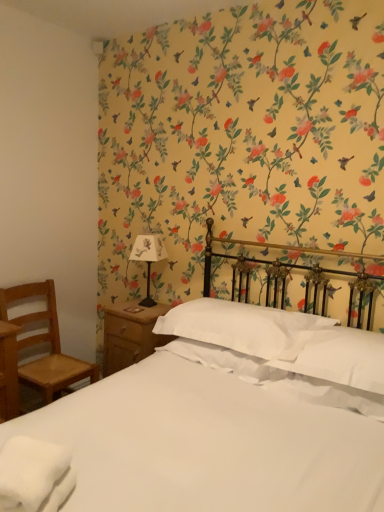
Question: From a real-world perspective, is wooden chair at left below white soft towel at lower left?

Choices:
 (A) yes
 (B) no

Answer: (A)

Question: Is wooden chair at left aimed at white soft towel at lower left?

Choices:
 (A) yes
 (B) no

Answer: (B)

Question: From a real-world perspective, is wooden chair at left located higher than white soft towel at lower left?

Choices:
 (A) no
 (B) yes

Answer: (A)

Question: From the image's perspective, does wooden chair at left appear higher than white soft towel at lower left?

Choices:
 (A) no
 (B) yes

Answer: (A)

Question: Does wooden chair at left have a greater width compared to white soft towel at lower left?

Choices:
 (A) yes
 (B) no

Answer: (A)

Question: Is white soft towel at lower left located within wooden chair at left?

Choices:
 (A) yes
 (B) no

Answer: (B)

Question: Is white satin bed at center wider than white soft pillow at center, the 2th pillow positioned from the right?

Choices:
 (A) yes
 (B) no

Answer: (A)

Question: Is white satin bed at center turned away from white soft pillow at center, the 1th pillow when ordered from left to right?

Choices:
 (A) yes
 (B) no

Answer: (A)

Question: Is white satin bed at center positioned behind white soft pillow at center, the 1th pillow when ordered from left to right?

Choices:
 (A) no
 (B) yes

Answer: (A)

Question: From the image's perspective, is white satin bed at center beneath white soft pillow at center, the 2th pillow positioned from the right?

Choices:
 (A) yes
 (B) no

Answer: (B)

Question: Is white satin bed at center aimed at white soft pillow at center, the 2th pillow positioned from the right?

Choices:
 (A) yes
 (B) no

Answer: (B)

Question: Considering the relative sizes of white satin bed at center and white soft pillow at center, the 1th pillow when ordered from left to right, in the image provided, is white satin bed at center smaller than white soft pillow at center, the 1th pillow when ordered from left to right,?

Choices:
 (A) no
 (B) yes

Answer: (A)

Question: Does white soft pillow at center, which ranks as the 2th pillow in left-to-right order, touch white paper lampshade at upper left?

Choices:
 (A) no
 (B) yes

Answer: (A)